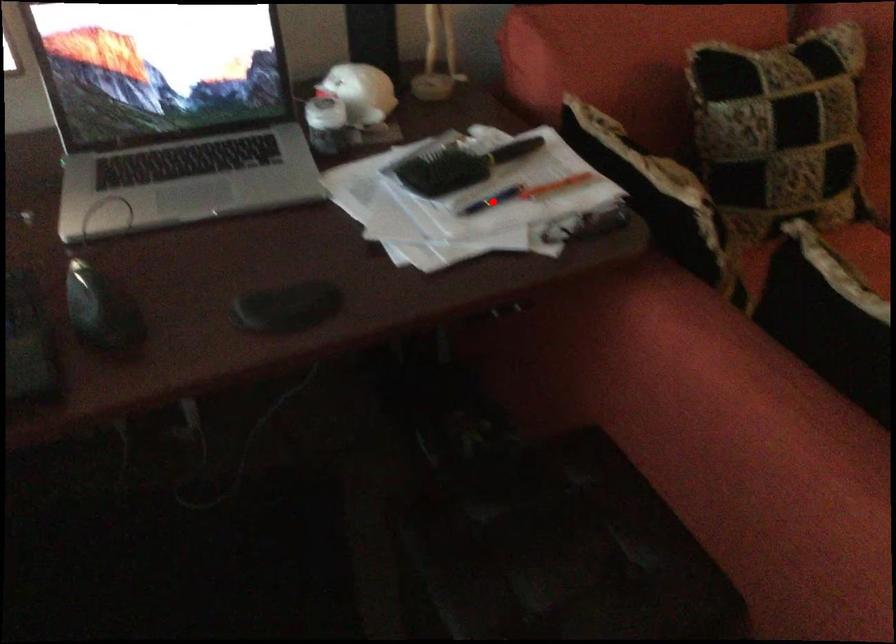
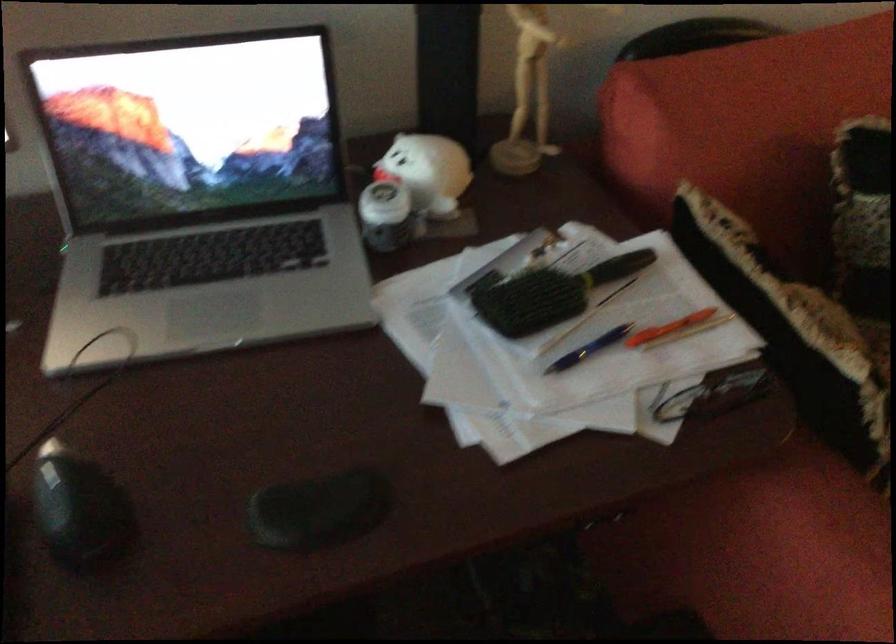
Question: I am providing you with two images of the same scene from different viewpoints. Image1 has a red point marked. In image2, the corresponding 3D location appears at what relative position? Reply with the corresponding letter.

Choices:
 (A) Closer
 (B) Farther

Answer: (A)